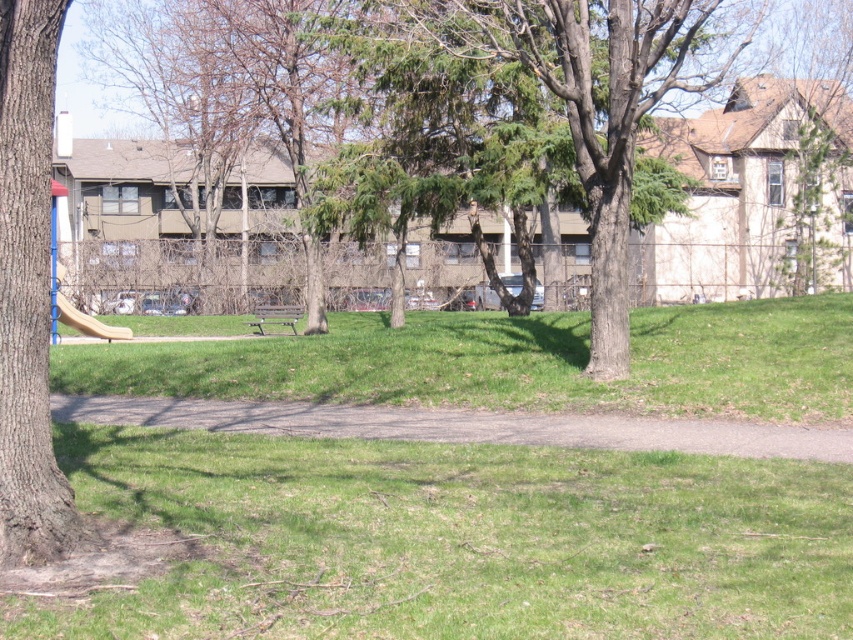
Question: In this image, where is brown rough bark tree at left located relative to wooden bench at center?

Choices:
 (A) above
 (B) below

Answer: (B)

Question: Is brown rough bark tree at left wider than wooden bench at center?

Choices:
 (A) no
 (B) yes

Answer: (A)

Question: Which object is closer to the camera taking this photo?

Choices:
 (A) green textured tree at center
 (B) brown rough bark tree at left
 (C) light brown plastic slide at left

Answer: (B)

Question: Which of the following is the closest to the observer?

Choices:
 (A) green textured tree at center
 (B) wooden bench at center
 (C) light brown plastic slide at lower left
 (D) brown rough bark tree at left

Answer: (D)

Question: Based on their relative distances, which object is farther from the brown rough bark tree at left?

Choices:
 (A) wooden bench at center
 (B) light brown plastic slide at left
 (C) light brown plastic slide at lower left

Answer: (A)

Question: Does green textured tree at center have a smaller size compared to brown rough bark tree at left?

Choices:
 (A) no
 (B) yes

Answer: (A)